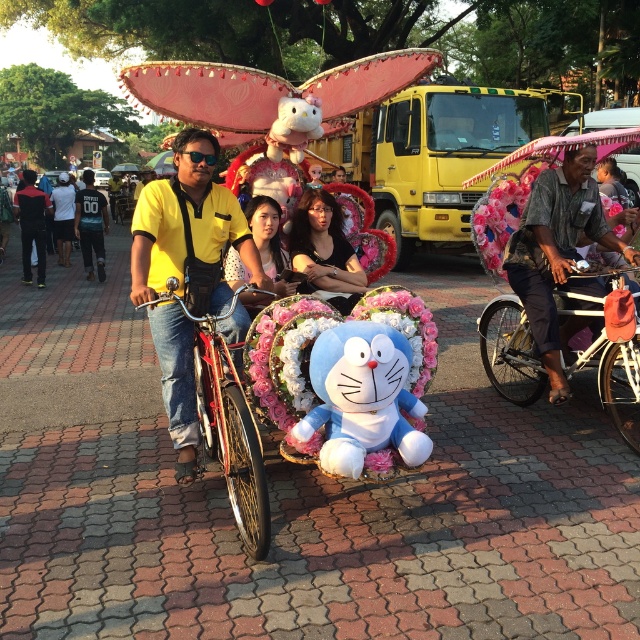
In the scene shown: Is blue plush toy at center to the right of light brown hair at center from the viewer's perspective?

Yes, blue plush toy at center is to the right of light brown hair at center.

Can you confirm if blue plush toy at center is thinner than light brown hair at center?

No.

Is point (358, 404) in front of point (262, 262)?

Yes, it is in front of point (262, 262).

Where is `blue plush toy at center`? The height and width of the screenshot is (640, 640). blue plush toy at center is located at coordinates (362, 397).

Can you confirm if light brown hair at center is positioned below dark blue jersey at left?

Correct, light brown hair at center is located below dark blue jersey at left.

In the scene shown: Who is higher up, light brown hair at center or dark blue jersey at left?

dark blue jersey at left is above.

Is point (227, 284) positioned before point (81, 200)?

Yes, it is in front of point (81, 200).

Find the location of a particular element. light brown hair at center is located at coordinates (269, 241).

Consider the image. Measure the distance between point (218,406) and camera.

11.78 feet

Locate an element on the screen. metallic red bicycle at center is located at coordinates (227, 424).

Identify the location of metallic red bicycle at center. (227, 424).